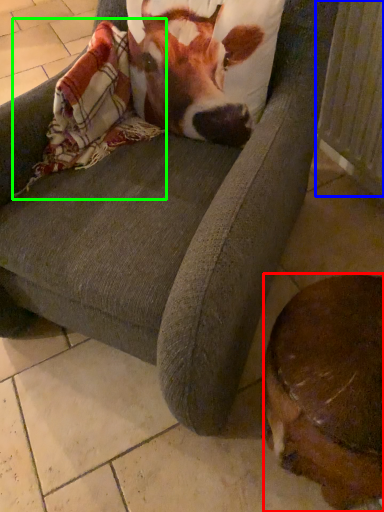
Question: Which is nearer to the dog (highlighted by a red box)? radiator (highlighted by a blue box) or blanket (highlighted by a green box).

Choices:
 (A) radiator
 (B) blanket

Answer: (B)